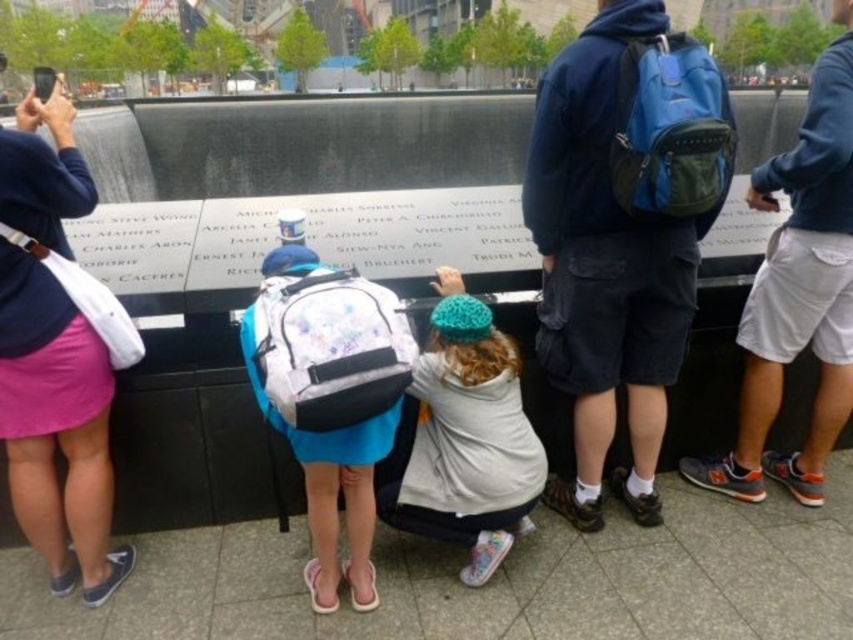
Based on the photo, who is shorter, blue fabric backpack at center or white knit hat at center?

white knit hat at center is shorter.

Consider the image. Who is taller, blue fabric backpack at center or white knit hat at center?

blue fabric backpack at center is taller.

The image size is (853, 640). What do you see at coordinates (622, 232) in the screenshot? I see `blue fabric backpack at center` at bounding box center [622, 232].

What are the coordinates of `blue fabric backpack at center` in the screenshot? It's located at (622, 232).

Can you confirm if blue fabric backpack at center is thinner than gray cotton shorts at right?

Yes.

Can you confirm if blue fabric backpack at center is shorter than gray cotton shorts at right?

A: Yes.

What do you see at coordinates (622, 232) in the screenshot? I see `blue fabric backpack at center` at bounding box center [622, 232].

Find the location of a particular element. blue fabric backpack at center is located at coordinates (622, 232).

Does pink fabric skirt at left appear under black plastic phone at upper left?

Yes, pink fabric skirt at left is below black plastic phone at upper left.

Does pink fabric skirt at left have a larger size compared to black plastic phone at upper left?

No, pink fabric skirt at left is not bigger than black plastic phone at upper left.

What do you see at coordinates (56, 426) in the screenshot?
I see `pink fabric skirt at left` at bounding box center [56, 426].

Identify the location of pink fabric skirt at left. (56, 426).